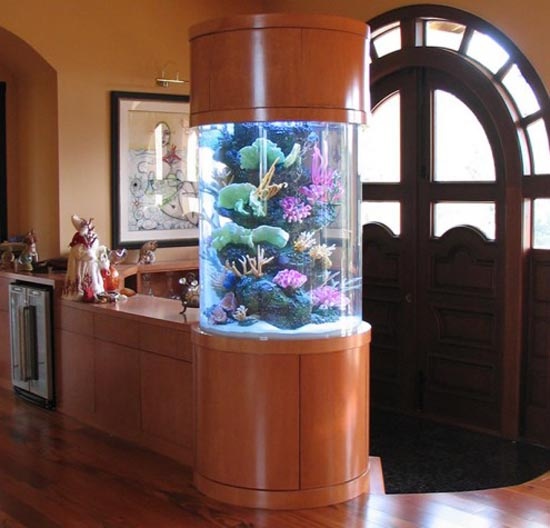
Find the location of a particular element. The image size is (550, 528). door is located at coordinates (377, 323).